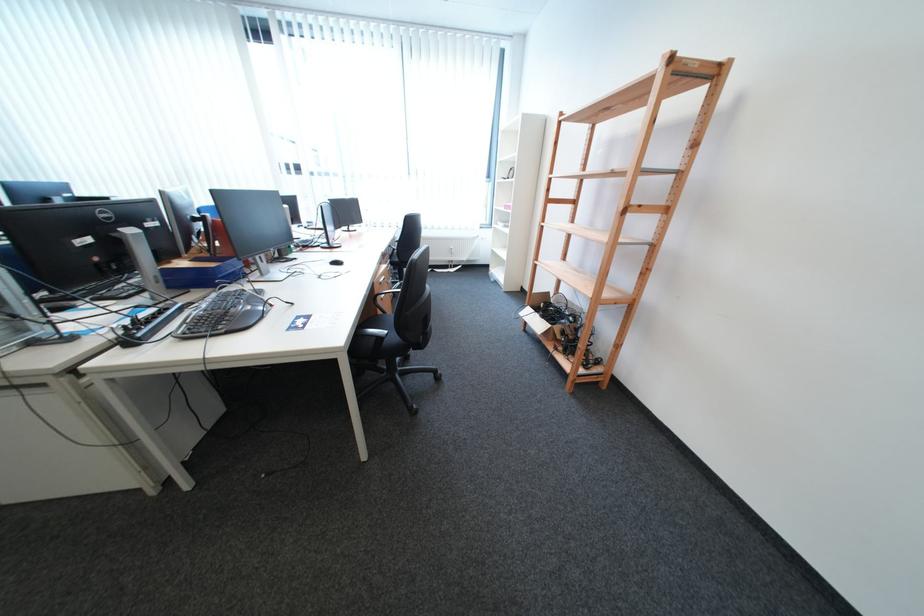
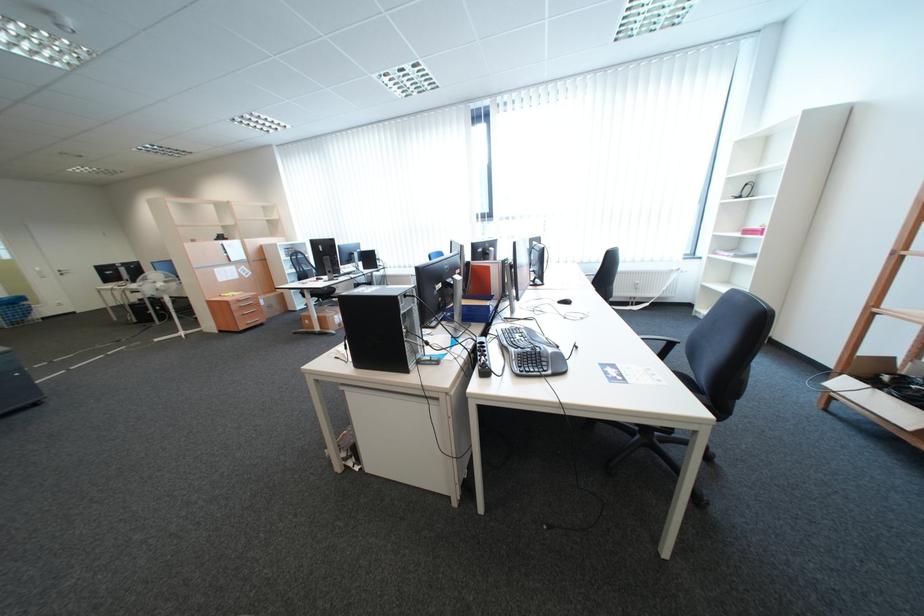
Question: Based on the continuous images, in which direction is the camera rotating? Reply with the corresponding letter.

Choices:
 (A) Left
 (B) Right
 (C) Up
 (D) Down

Answer: (A)